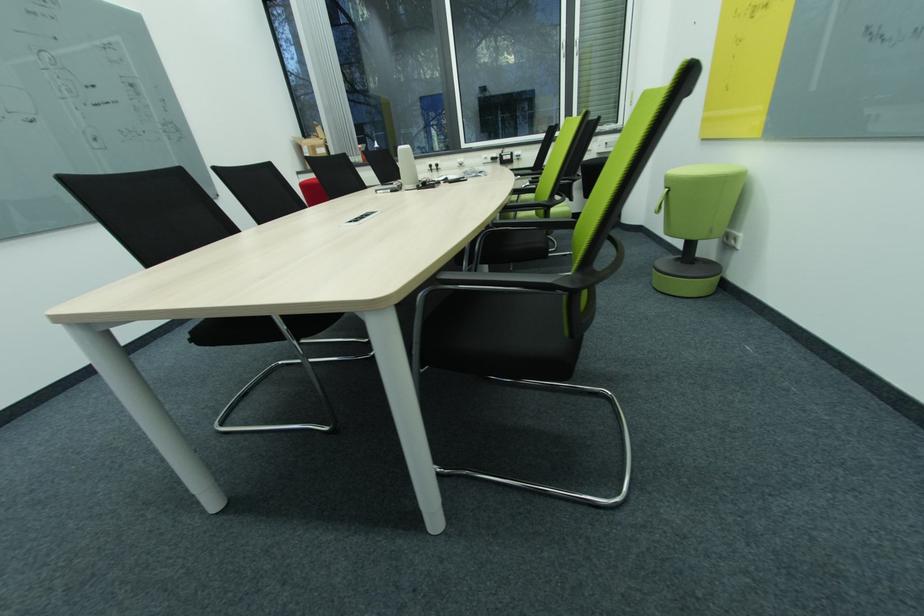
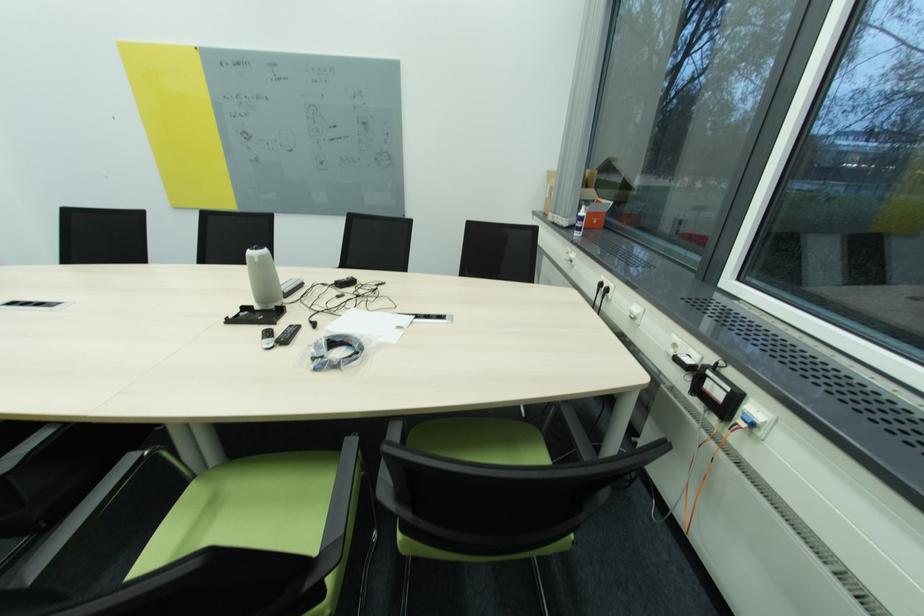
Where in the second image is the point corresponding to the point at 304,169 from the first image?

(544, 209)